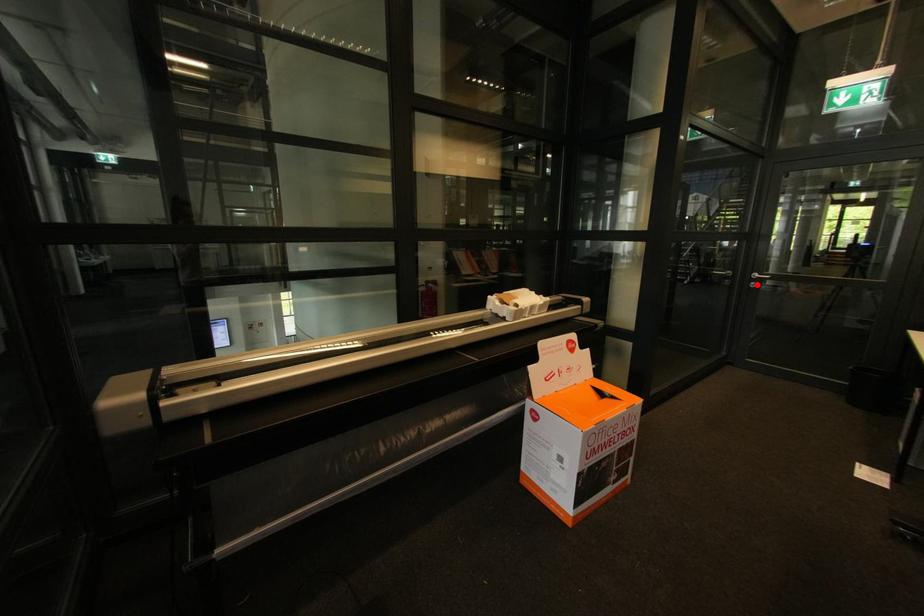
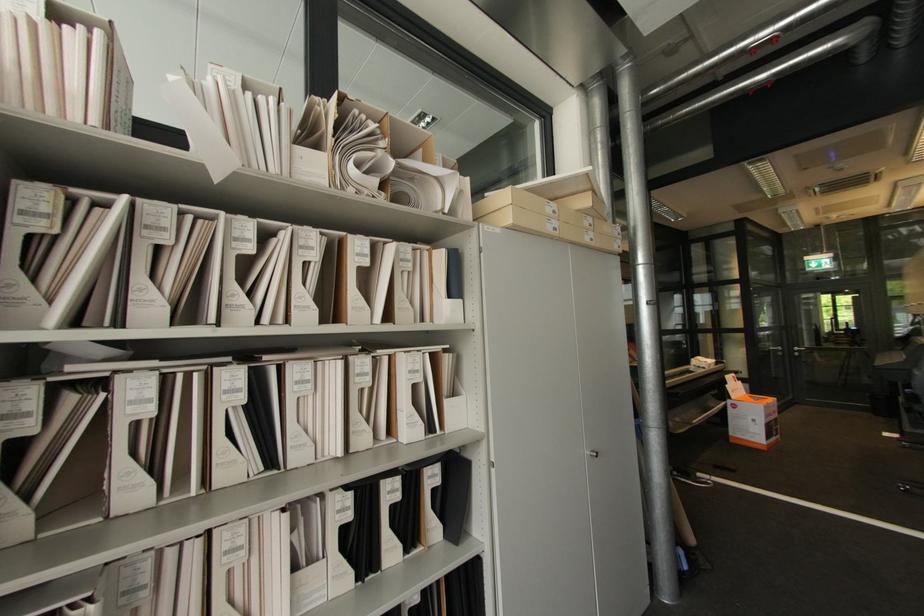
Question: I am providing you with two images of the same scene from different viewpoints. A red point is shown in image1. For the corresponding object point in image2, is it positioned nearer or farther from the camera?

Choices:
 (A) Nearer
 (B) Farther

Answer: (A)